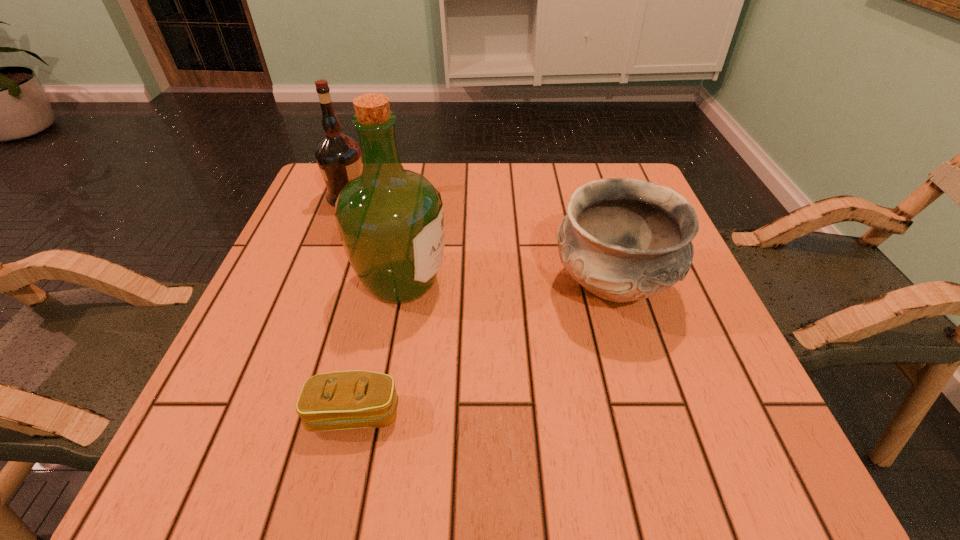
Locate which object is the closest to the farther liquor. Please provide its 2D coordinates. Your answer should be formatted as a tuple, i.e. [(x, y)], where the tuple contains the x and y coordinates of a point satisfying the conditions above.

[(391, 223)]

Locate an element on the screen. The width and height of the screenshot is (960, 540). object identified as the closest to the left liquor is located at coordinates (391, 223).

Locate an element on the screen. Image resolution: width=960 pixels, height=540 pixels. vacant space that satisfies the following two spatial constraints: 1. on the back side of the second shortest object; 2. on the front-facing side of the tallest object is located at coordinates (611, 282).

Image resolution: width=960 pixels, height=540 pixels. I want to click on free space that satisfies the following two spatial constraints: 1. on the front-facing side of the taller liquor; 2. on the zipper side of the shortest object, so (x=378, y=414).

This screenshot has width=960, height=540. Find the location of `free space that satisfies the following two spatial constraints: 1. on the front-facing side of the pottery; 2. on the left side of the taller liquor`. free space that satisfies the following two spatial constraints: 1. on the front-facing side of the pottery; 2. on the left side of the taller liquor is located at coordinates (401, 285).

What are the coordinates of `vacant space that satisfies the following two spatial constraints: 1. on the front-facing side of the nearer liquor; 2. on the zipper side of the nearest object` in the screenshot? It's located at (378, 414).

This screenshot has width=960, height=540. I want to click on free location that satisfies the following two spatial constraints: 1. on the front-facing side of the nearer liquor; 2. on the left side of the third tallest object, so pos(401,285).

The height and width of the screenshot is (540, 960). In order to click on vacant region that satisfies the following two spatial constraints: 1. on the front-facing side of the right liquor; 2. on the back side of the pottery in this screenshot , I will do `click(401, 285)`.